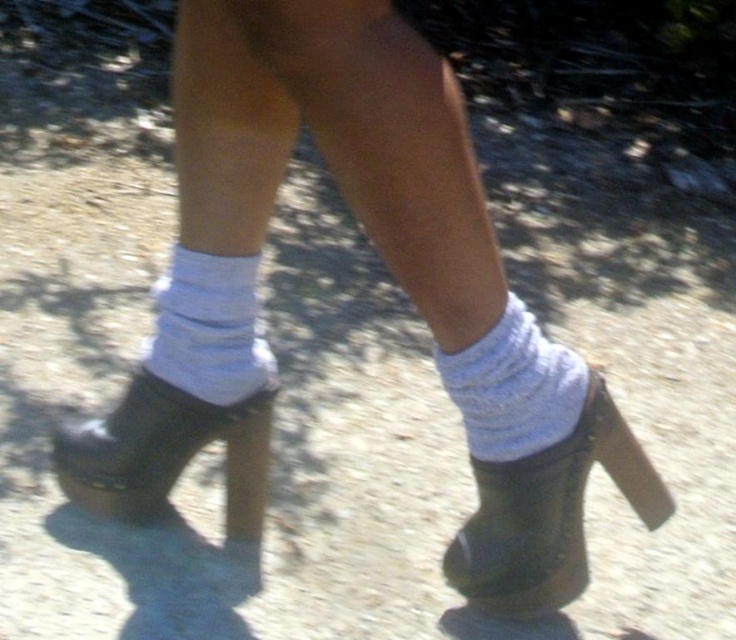
You are a photographer trying to capture a detailed shot of the point at coordinates point (503, 392). Your camera has a minimum focus distance of 3 feet. Will the camera be able to focus on the point?

The point (503, 392) is 3.32 feet from the camera, which is beyond the minimum focus distance of 3 feet. Therefore, the camera should be able to focus on the point.

You are designing a shoe organizer and need to know the relative widths of the matte olive green boot at lower left and the white knitted sock at lower center. Based on the image, which one is wider?

The matte olive green boot at lower left is wider than the white knitted sock at lower center according to the description.

You are standing 1 meter away from the matte olive green boot at lower left. Can you reach it without moving your feet?

The matte olive green boot at lower left is 1.12 meters away from the viewer. Since you are standing 1 meter away, you cannot reach it without moving your feet because the distance is slightly more than your reach.